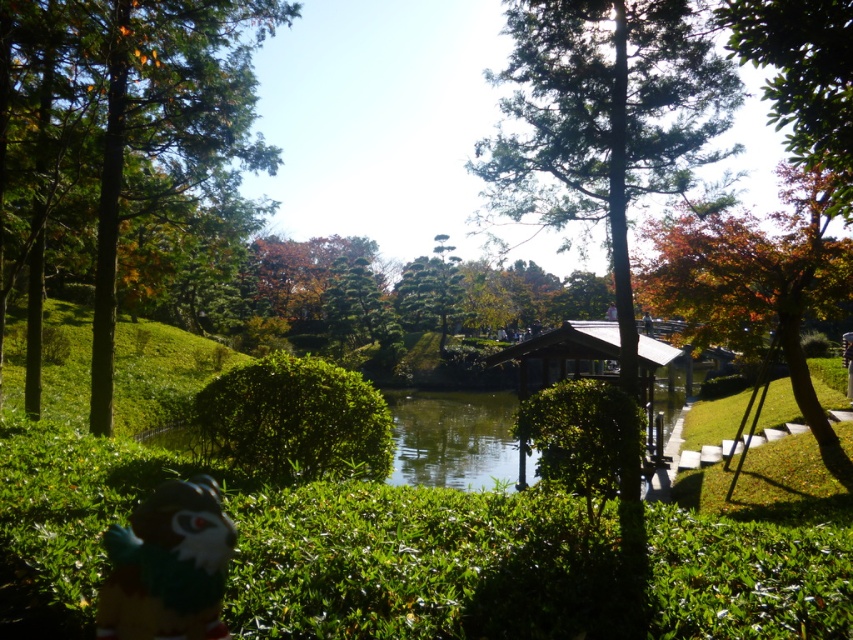
In the Japanese garden scene, you notice a green leafy bush at center and a green leafy tree at upper right. Which of these two plants has a greater width?

The green leafy bush at center has a greater width than the green leafy tree at upper right.

You are a visitor in the Japanese garden and want to take a photo of both the green textured tree at center and the green textured pine tree at center. Can you stand at a position where both are visible in the same frame without moving the camera?

The green textured tree at center and green textured pine tree at center are 26.50 meters apart. Since they are relatively far apart, you can position yourself at a distance where both can be captured in the same camera frame.

You are a visitor in the Japanese garden and want to take a photo of the green leafy tree at upper right and the green textured pine tree at center. Which tree should you focus on first if you want to capture both in the same frame without moving the camera?

The green leafy tree at upper right is below the green textured pine tree at center, so you should focus on the green textured pine tree at center first to ensure both are in the frame.